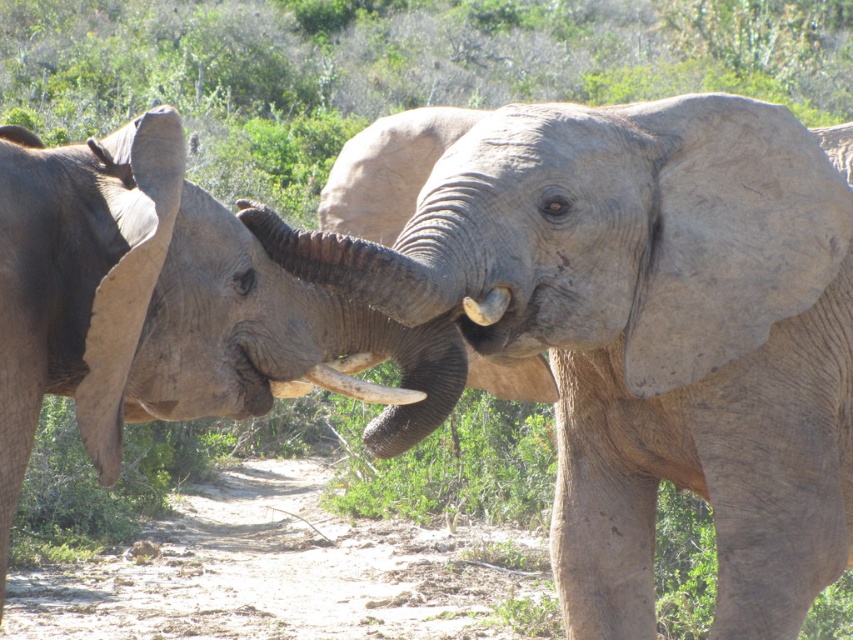
You are standing at the camera position and want to take a photo of the gray rough skin elephant at center. If you move forward 3 feet, will the elephant still be in frame?

The gray rough skin elephant at center is 8.00 feet away from the camera. Moving forward 3 feet would bring you to 5.00 feet away, which is still within a typical camera frame, so yes, the elephant will still be in frame.

In the scene shown: You are a wildlife photographer aiming to capture a closeup of the white ivory tusk at center while also including the gray rough skin elephant at center in the frame. Based on their positions, will you need to adjust your camera angle upwards or downwards to focus on the tusk?

The gray rough skin elephant at center is located above the white ivory tusk at center, so you will need to adjust your camera angle downwards to focus on the tusk while keeping the elephant in frame.

You are standing at the origin point in the image, which is the bottom left corner. You want to locate the gray rough skin elephant at center. Which direction should you move from the origin to find it?

The gray rough skin elephant at center is located at point [648,332], so you should move northeast from the origin to find it.